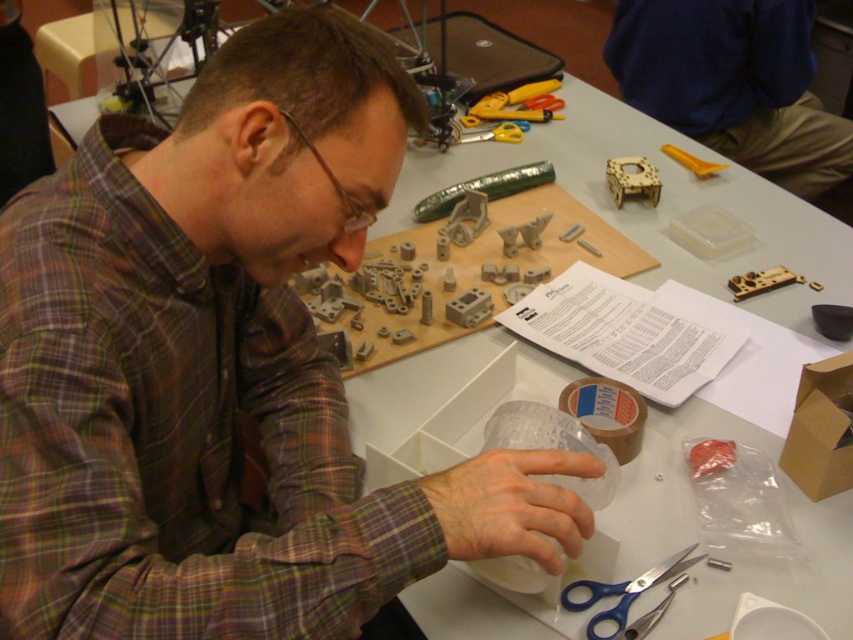
Is matte plastic cup at center below yellow plastic screwdriver at upper right?

Correct, matte plastic cup at center is located below yellow plastic screwdriver at upper right.

Who is shorter, matte plastic cup at center or yellow plastic screwdriver at upper right?

yellow plastic screwdriver at upper right

At what (x,y) coordinates should I click in order to perform the action: click on matte plastic cup at center. Please return your answer as a coordinate pair (x, y). Looking at the image, I should click on (223, 368).

Does wooden puzzle piece at upper right have a smaller size compared to blue plastic scissors at lower center?

No, wooden puzzle piece at upper right is not smaller than blue plastic scissors at lower center.

Between point (808, 192) and point (577, 582), which one is positioned behind?

The point (808, 192) is behind.

Measure the distance between wooden puzzle piece at upper right and camera.

5.72 feet

The width and height of the screenshot is (853, 640). What are the coordinates of `wooden puzzle piece at upper right` in the screenshot? It's located at (733, 83).

Can you confirm if wooden puzzle piece at upper right is positioned below metallic gold gear at upper right?

Incorrect, wooden puzzle piece at upper right is not positioned below metallic gold gear at upper right.

Does wooden puzzle piece at upper right have a larger size compared to metallic gold gear at upper right?

Yes.

Does point (734, 150) come behind point (791, 282)?

Yes, point (734, 150) is farther from viewer.

Where is `wooden puzzle piece at upper right`? This screenshot has height=640, width=853. wooden puzzle piece at upper right is located at coordinates (733, 83).